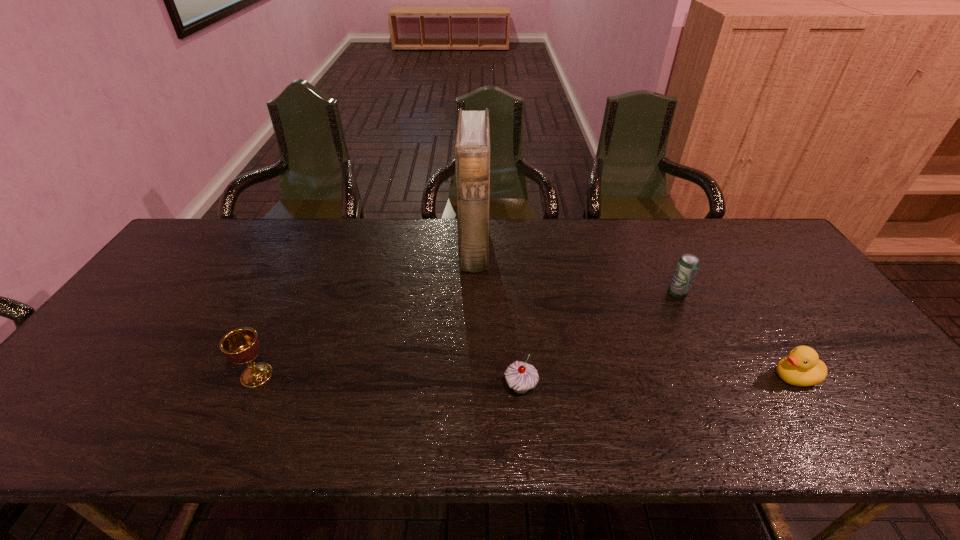
Identify which object is located as the fourth nearest to the duckling. Please provide its 2D coordinates. Your answer should be formatted as a tuple, i.e. [(x, y)], where the tuple contains the x and y coordinates of a point satisfying the conditions above.

[(242, 345)]

Identify the location of object that stands as the closest to the third object from left to right. The image size is (960, 540). (472, 147).

You are a GUI agent. You are given a task and a screenshot of the screen. Output one action in this format:
    pyautogui.click(x=<x>, y=<y>)
    Task: Click on the free spot that satisfies the following two spatial constraints: 1. on the cover of the second object from right to left; 2. on the left side of the tallest object
    Image resolution: width=960 pixels, height=540 pixels.
    Given the screenshot: What is the action you would take?
    pyautogui.click(x=473, y=295)

Locate an element on the screen. Image resolution: width=960 pixels, height=540 pixels. free space that satisfies the following two spatial constraints: 1. on the cover of the farthest object; 2. on the right side of the second farthest object is located at coordinates (473, 295).